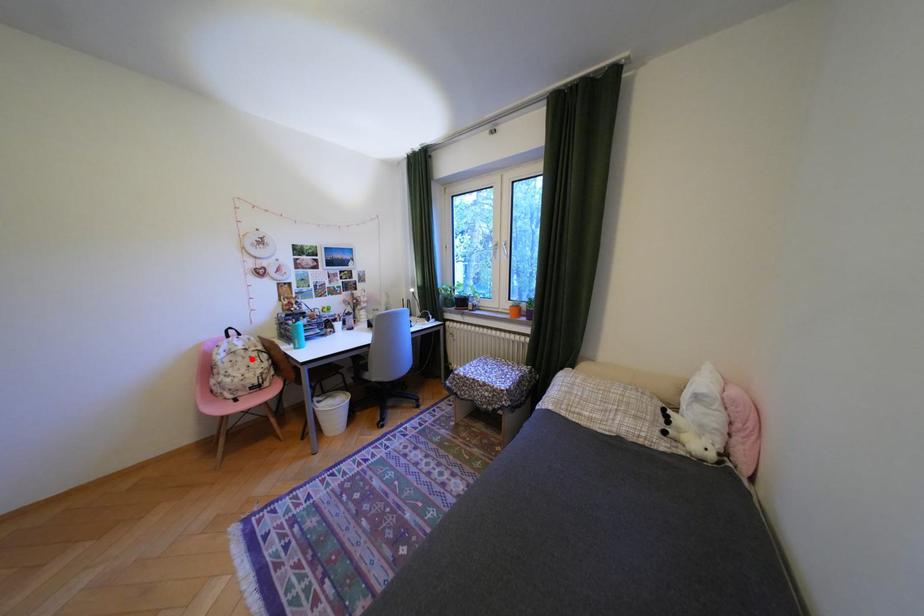
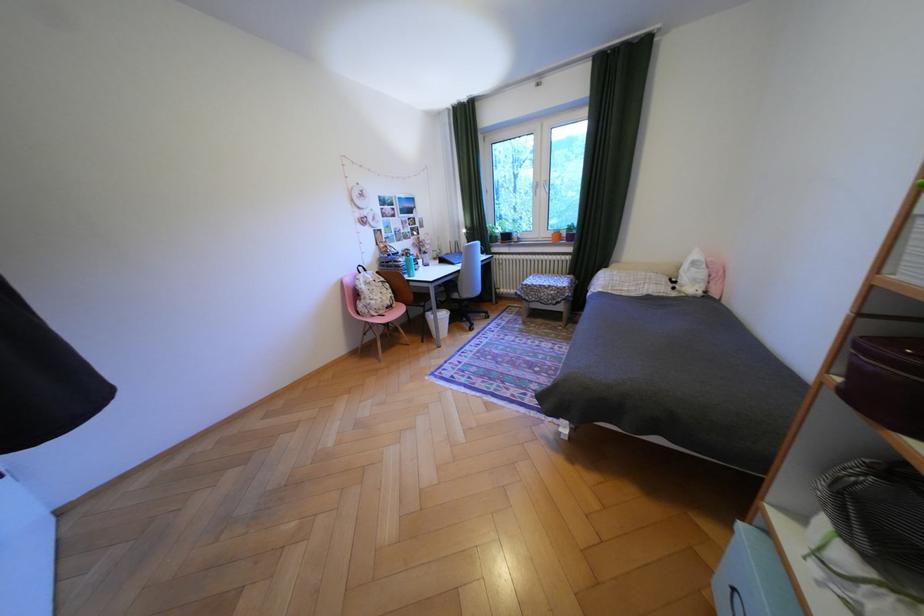
Question: I am providing you with two images of the same scene from different viewpoints. Given a red point in image1, look at the same physical point in image2. Is it:

Choices:
 (A) Closer to the viewpoint
 (B) Farther from the viewpoint

Answer: (A)